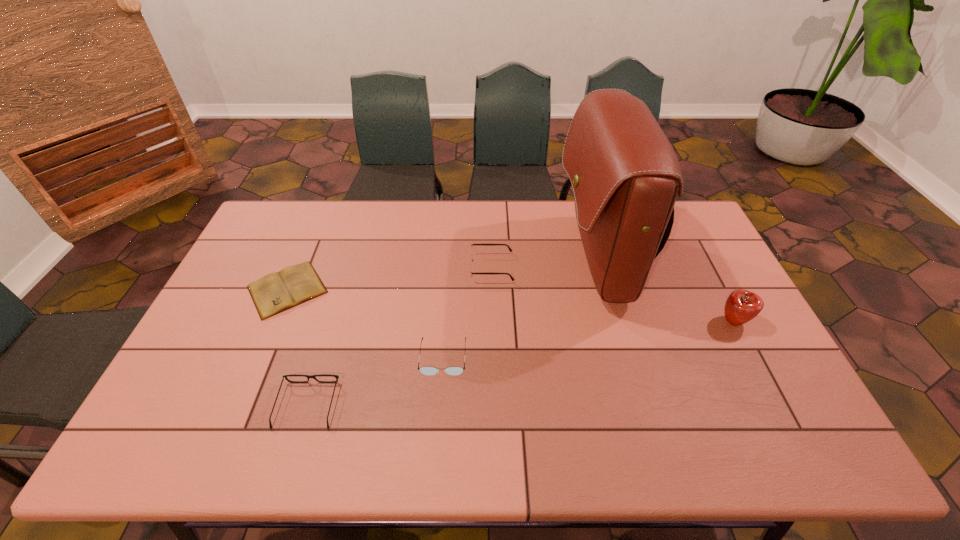
This screenshot has height=540, width=960. What are the coordinates of `vacant area that lies between the second spectacles from right to left and the third object from right to left` in the screenshot? It's located at (468, 313).

The image size is (960, 540). In order to click on vacant point located between the leftmost spectacles and the book in this screenshot , I will do `click(298, 347)`.

Find the location of a particular element. empty location between the second nearest object and the satchel is located at coordinates (520, 308).

Where is `object that is the fifth nearest to the farthest spectacles`? object that is the fifth nearest to the farthest spectacles is located at coordinates (741, 306).

Identify which object is the closest to the shortest object. Please provide its 2D coordinates. Your answer should be formatted as a tuple, i.e. [(x, y)], where the tuple contains the x and y coordinates of a point satisfying the conditions above.

[(284, 376)]

I want to click on the closest spectacles relative to the fourth object from right to left, so click(x=284, y=376).

Image resolution: width=960 pixels, height=540 pixels. Find the location of `the second closest spectacles to the nearest object`. the second closest spectacles to the nearest object is located at coordinates (471, 246).

This screenshot has width=960, height=540. Find the location of `free space that satisfies the following two spatial constraints: 1. on the open flap of the tallest object; 2. on the left side of the rightmost object`. free space that satisfies the following two spatial constraints: 1. on the open flap of the tallest object; 2. on the left side of the rightmost object is located at coordinates [x=614, y=321].

I want to click on vacant region that satisfies the following two spatial constraints: 1. at the hinge ends of the third object from right to left; 2. on the lenses of the second spectacles from left to right, so click(x=493, y=357).

Image resolution: width=960 pixels, height=540 pixels. I want to click on vacant region that satisfies the following two spatial constraints: 1. on the open flap of the satchel; 2. on the lenses of the third object from left to right, so click(624, 357).